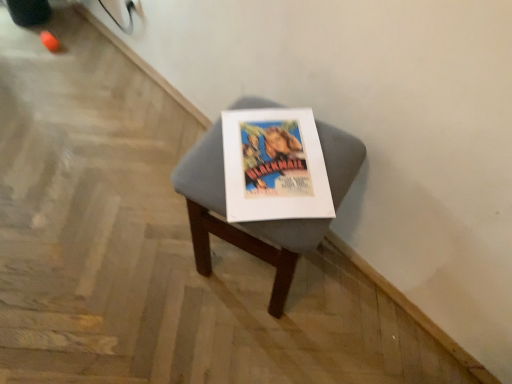
Question: From the image's perspective, relative to gray fabric stool at center, is matte paper poster at center above or below?

Choices:
 (A) above
 (B) below

Answer: (A)

Question: Is matte paper poster at center taller or shorter than gray fabric stool at center?

Choices:
 (A) tall
 (B) short

Answer: (B)

Question: In the image, is matte paper poster at center on the left side or the right side of gray fabric stool at center?

Choices:
 (A) left
 (B) right

Answer: (B)

Question: Relative to matte paper poster at center, is gray fabric stool at center in front or behind?

Choices:
 (A) behind
 (B) front

Answer: (B)

Question: Based on their sizes in the image, would you say gray fabric stool at center is bigger or smaller than matte paper poster at center?

Choices:
 (A) big
 (B) small

Answer: (A)

Question: In terms of height, does gray fabric stool at center look taller or shorter compared to matte paper poster at center?

Choices:
 (A) short
 (B) tall

Answer: (B)

Question: Is point (356, 150) positioned closer to the camera than point (294, 145)?

Choices:
 (A) farther
 (B) closer

Answer: (A)